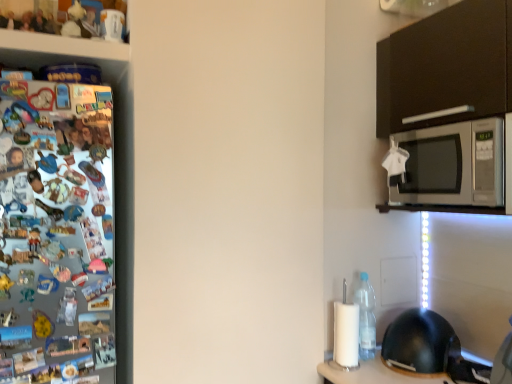
Question: From the image's perspective, is clear plastic bottle at lower right located beneath black matte helmet at lower right?

Choices:
 (A) no
 (B) yes

Answer: (A)

Question: Would you say clear plastic bottle at lower right contains black matte helmet at lower right?

Choices:
 (A) yes
 (B) no

Answer: (B)

Question: Is clear plastic bottle at lower right bigger than black matte helmet at lower right?

Choices:
 (A) yes
 (B) no

Answer: (B)

Question: Could you tell me if clear plastic bottle at lower right is facing black matte helmet at lower right?

Choices:
 (A) yes
 (B) no

Answer: (A)

Question: Does clear plastic bottle at lower right have a greater height compared to black matte helmet at lower right?

Choices:
 (A) yes
 (B) no

Answer: (A)

Question: Is clear plastic bottle at lower right smaller than black matte helmet at lower right?

Choices:
 (A) no
 (B) yes

Answer: (B)

Question: Does clear plastic bottle at lower right come in front of silver metallic microwave at upper right?

Choices:
 (A) no
 (B) yes

Answer: (A)

Question: Is clear plastic bottle at lower right oriented away from silver metallic microwave at upper right?

Choices:
 (A) no
 (B) yes

Answer: (A)

Question: From a real-world perspective, does clear plastic bottle at lower right stand above silver metallic microwave at upper right?

Choices:
 (A) yes
 (B) no

Answer: (B)

Question: Is clear plastic bottle at lower right wider than silver metallic microwave at upper right?

Choices:
 (A) no
 (B) yes

Answer: (A)

Question: Is clear plastic bottle at lower right smaller than silver metallic microwave at upper right?

Choices:
 (A) yes
 (B) no

Answer: (A)

Question: Is clear plastic bottle at lower right next to silver metallic microwave at upper right and touching it?

Choices:
 (A) yes
 (B) no

Answer: (B)

Question: Is silver metallic microwave at upper right in contact with black matte helmet at lower right?

Choices:
 (A) no
 (B) yes

Answer: (A)